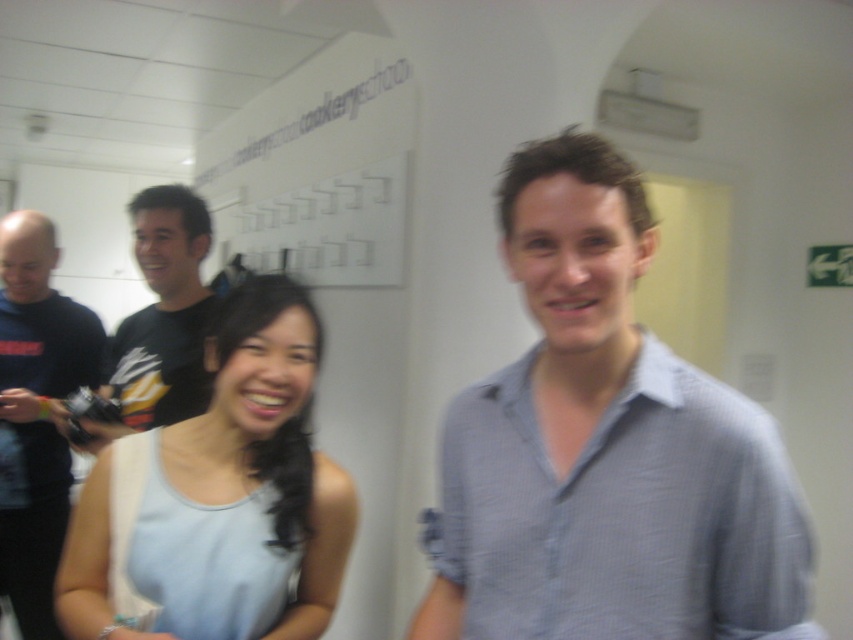
Question: Considering the real-world distances, which object is farthest from the black jersey at center?

Choices:
 (A) light blue checkered shirt at center
 (B) white matte signboard at upper center
 (C) dark blue t-shirt at left
 (D) light blue fabric dress at center

Answer: (B)

Question: Can you confirm if white matte signboard at upper center is positioned above black jersey at center?

Choices:
 (A) yes
 (B) no

Answer: (A)

Question: From the image, what is the correct spatial relationship of white matte signboard at upper center in relation to black jersey at center?

Choices:
 (A) below
 (B) above

Answer: (B)

Question: Is white matte signboard at upper center closer to the viewer compared to black jersey at center?

Choices:
 (A) no
 (B) yes

Answer: (A)

Question: Which is farther from the dark blue t-shirt at left?

Choices:
 (A) white matte signboard at upper center
 (B) light blue checkered shirt at center

Answer: (B)

Question: Among these points, which one is farthest from the camera?

Choices:
 (A) (30, 464)
 (B) (340, 273)
 (C) (256, 400)
 (D) (654, 518)

Answer: (B)